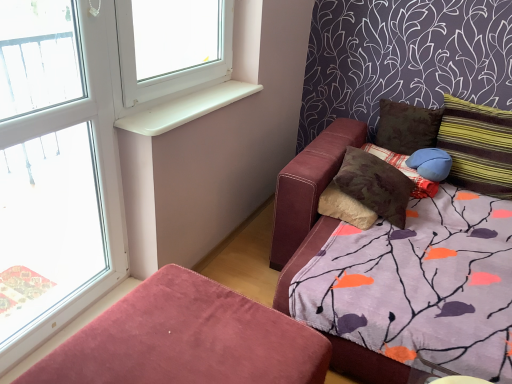
Where is `white plastic window sill at upper left`? The image size is (512, 384). white plastic window sill at upper left is located at coordinates (186, 108).

The width and height of the screenshot is (512, 384). Describe the element at coordinates (57, 167) in the screenshot. I see `clear glass window at left` at that location.

Image resolution: width=512 pixels, height=384 pixels. I want to click on velvet ottoman at lower left, so click(x=186, y=339).

Between blue fabric pillow at upper right, placed as the 2th pillow when sorted from right to left, and clear glass window at left, which one appears on the right side from the viewer's perspective?

blue fabric pillow at upper right, placed as the 2th pillow when sorted from right to left, is more to the right.

Which point is more forward, (446, 158) or (13, 200)?

The point (13, 200) is closer.

Is blue fabric pillow at upper right, which is the third pillow in left-to-right order, spatially inside clear glass window at left, or outside of it?

blue fabric pillow at upper right, which is the third pillow in left-to-right order, cannot be found inside clear glass window at left.

Is white plastic window sill at upper left further to the viewer compared to velvet ottoman at lower left?

Yes.

Does white plastic window sill at upper left have a greater width compared to velvet ottoman at lower left?

No, white plastic window sill at upper left is not wider than velvet ottoman at lower left.

From a real-world perspective, is white plastic window sill at upper left physically above velvet ottoman at lower left?

Yes.

Which is in front, point (192, 95) or point (204, 299)?

The point (204, 299) is in front.

Which is more to the right, brown textured pillow at upper right, acting as the 1th pillow starting from the left, or velvet ottoman at lower left?

From the viewer's perspective, brown textured pillow at upper right, acting as the 1th pillow starting from the left, appears more on the right side.

Who is bigger, brown textured pillow at upper right, acting as the 1th pillow starting from the left, or velvet ottoman at lower left?

With larger size is velvet ottoman at lower left.

Does brown textured pillow at upper right, which is the fourth pillow from right to left, have a greater width compared to velvet ottoman at lower left?

No.

From a real-world perspective, is velvet ottoman at lower left located higher than brown fabric pillow at upper right, the 2th pillow viewed from the left?

No, from a real-world perspective, velvet ottoman at lower left is not over brown fabric pillow at upper right, the 2th pillow viewed from the left

From the image's perspective, is velvet ottoman at lower left above or below brown fabric pillow at upper right, placed as the third pillow when sorted from right to left?

velvet ottoman at lower left is below brown fabric pillow at upper right, placed as the third pillow when sorted from right to left.

In terms of size, does velvet ottoman at lower left appear bigger or smaller than brown fabric pillow at upper right, the 2th pillow viewed from the left?

Clearly, velvet ottoman at lower left is larger in size than brown fabric pillow at upper right, the 2th pillow viewed from the left.

Considering the sizes of objects brown fabric pillow at upper right, the 2th pillow viewed from the left, and velvet ottoman at lower left in the image provided, who is thinner, brown fabric pillow at upper right, the 2th pillow viewed from the left, or velvet ottoman at lower left?

brown fabric pillow at upper right, the 2th pillow viewed from the left.

Does brown fabric pillow at upper right, the 2th pillow viewed from the left, turn towards velvet ottoman at lower left?

Yes, brown fabric pillow at upper right, the 2th pillow viewed from the left, is turned towards velvet ottoman at lower left.

Which is more to the left, brown fabric pillow at upper right, placed as the third pillow when sorted from right to left, or velvet ottoman at lower left?

velvet ottoman at lower left is more to the left.

Is clear glass window at left not inside blue fabric pillow at upper right, which is the third pillow in left-to-right order?

That's correct, clear glass window at left is outside of blue fabric pillow at upper right, which is the third pillow in left-to-right order.

Is clear glass window at left oriented towards blue fabric pillow at upper right, placed as the 2th pillow when sorted from right to left?

No, clear glass window at left is not turned towards blue fabric pillow at upper right, placed as the 2th pillow when sorted from right to left.

From a real-world perspective, which object rests below the other?

blue fabric pillow at upper right, which is the third pillow in left-to-right order.

Is clear glass window at left positioned behind blue fabric pillow at upper right, which is the third pillow in left-to-right order?

No, clear glass window at left is closer to the viewer.

From the image's perspective, is velvet ottoman at lower left on top of striped fabric pillow at right, marked as the first pillow in a right-to-left arrangement?

No.

Visually, is velvet ottoman at lower left positioned to the left or to the right of striped fabric pillow at right, the fourth pillow viewed from the left?

Clearly, velvet ottoman at lower left is on the left of striped fabric pillow at right, the fourth pillow viewed from the left, in the image.

Looking at this image, between velvet ottoman at lower left and striped fabric pillow at right, marked as the first pillow in a right-to-left arrangement, which one has more height?

Standing taller between the two is striped fabric pillow at right, marked as the first pillow in a right-to-left arrangement.

At what (x,y) coordinates should I click in order to perform the action: click on furniture below the striped fabric pillow at right, the fourth pillow viewed from the left (from the image's perspective). Please return your answer as a coordinate pair (x, y). Looking at the image, I should click on coord(186,339).

Starting from the clear glass window at left, which pillow is the 3rd one behind? Please provide its 2D coordinates.

[(431, 163)]

The image size is (512, 384). Find the location of `furniture on the right of white plastic window sill at upper left`. furniture on the right of white plastic window sill at upper left is located at coordinates (186, 339).

Estimate the real-world distances between objects in this image. Which object is closer to white plastic window sill at upper left, striped fabric pillow at right, marked as the first pillow in a right-to-left arrangement, or velvet ottoman at lower left?

The object closer to white plastic window sill at upper left is velvet ottoman at lower left.

Estimate the real-world distances between objects in this image. Which object is closer to brown fabric pillow at upper right, placed as the third pillow when sorted from right to left, velvet ottoman at lower left or white plastic window sill at upper left?

white plastic window sill at upper left lies closer to brown fabric pillow at upper right, placed as the third pillow when sorted from right to left, than the other object.

When comparing their distances from clear glass window at left, does white plastic window sill at upper left or blue fabric pillow at upper right, placed as the 2th pillow when sorted from right to left, seem closer?

white plastic window sill at upper left is positioned closer to the anchor clear glass window at left.

Considering their positions, is white plastic window sill at upper left positioned closer to brown textured pillow at upper right, acting as the 1th pillow starting from the left, than brown fabric pillow at upper right, the 2th pillow viewed from the left?

brown fabric pillow at upper right, the 2th pillow viewed from the left.

Looking at the image, which one is located closer to clear glass window at left, brown textured pillow at upper right, which is the fourth pillow from right to left, or white plastic window sill at upper left?

Among the two, white plastic window sill at upper left is located nearer to clear glass window at left.

Looking at the image, which one is located further to clear glass window at left, brown fabric pillow at upper right, the 2th pillow viewed from the left, or white plastic window sill at upper left?

Based on the image, brown fabric pillow at upper right, the 2th pillow viewed from the left, appears to be further to clear glass window at left.

Considering their positions, is brown fabric pillow at upper right, the 2th pillow viewed from the left, positioned further to blue fabric pillow at upper right, which is the third pillow in left-to-right order, than brown textured pillow at upper right, acting as the 1th pillow starting from the left?

Based on the image, brown fabric pillow at upper right, the 2th pillow viewed from the left, appears to be further to blue fabric pillow at upper right, which is the third pillow in left-to-right order.

From the image, which object appears to be farther from velvet ottoman at lower left, brown textured pillow at upper right, which is the fourth pillow from right to left, or white plastic window sill at upper left?

Based on the image, brown textured pillow at upper right, which is the fourth pillow from right to left, appears to be further to velvet ottoman at lower left.

Identify the location of furniture between clear glass window at left and blue fabric pillow at upper right, which is the third pillow in left-to-right order. (186, 339).

You are a GUI agent. You are given a task and a screenshot of the screen. Output one action in this format:
    pyautogui.click(x=<x>, y=<y>)
    Task: Click on the window frame positioned between velvet ottoman at lower left and brown fabric pillow at upper right, placed as the third pillow when sorted from right to left, from near to far
    
    Given the screenshot: What is the action you would take?
    pyautogui.click(x=57, y=167)

You are a GUI agent. You are given a task and a screenshot of the screen. Output one action in this format:
    pyautogui.click(x=<x>, y=<y>)
    Task: Click on the window sill between clear glass window at left and brown fabric pillow at upper right, the 2th pillow viewed from the left, from left to right
    
    Given the screenshot: What is the action you would take?
    pyautogui.click(x=186, y=108)

The height and width of the screenshot is (384, 512). What are the coordinates of `furniture situated between clear glass window at left and striped fabric pillow at right, the fourth pillow viewed from the left, from left to right` in the screenshot? It's located at (186, 339).